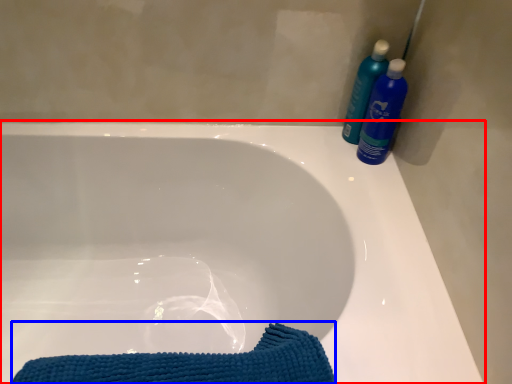
Question: Which object is closer to the camera taking this photo, bathtub (highlighted by a red box) or beach towel (highlighted by a blue box)?

Choices:
 (A) bathtub
 (B) beach towel

Answer: (A)